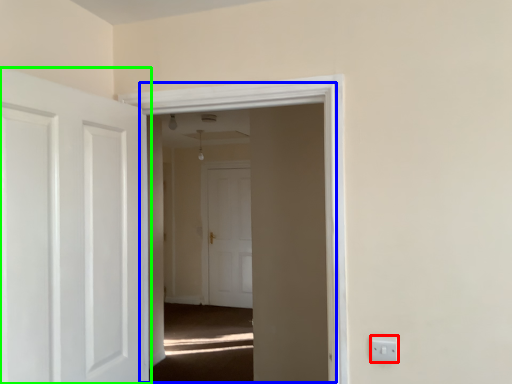
Question: Estimate the real-world distances between objects in this image. Which object is closer to electric outlet (highlighted by a red box), window (highlighted by a blue box) or door (highlighted by a green box)?

Choices:
 (A) window
 (B) door

Answer: (A)